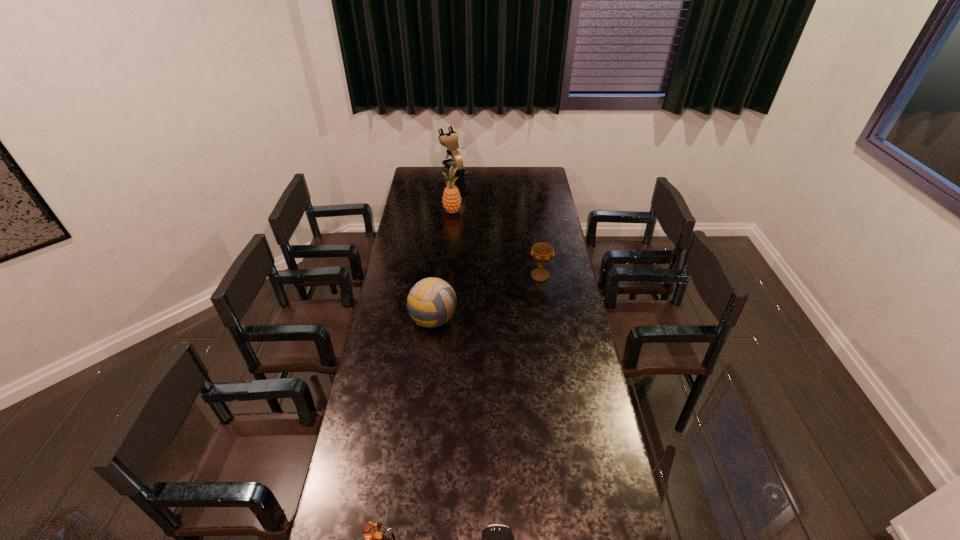
Identify the location of object that is at the far edge. The width and height of the screenshot is (960, 540). (449, 140).

Locate an element on the screen. object that is at the left edge is located at coordinates (431, 302).

Where is `object present at the right edge`? object present at the right edge is located at coordinates (542, 252).

Where is `free space at the far edge`? free space at the far edge is located at coordinates (476, 173).

Identify the location of blank area at the left edge. (431, 188).

Image resolution: width=960 pixels, height=540 pixels. I want to click on vacant point at the right edge, so click(537, 199).

Image resolution: width=960 pixels, height=540 pixels. What are the coordinates of `free space at the far left corner of the desktop` in the screenshot? It's located at (438, 171).

In the image, there is a desktop. Identify the location of vacant area at the far right corner. 549,186.

At what (x,y) coordinates should I click in order to perform the action: click on free point between the farthest object and the volleyball. Please return your answer as a coordinate pair (x, y). This screenshot has width=960, height=540. Looking at the image, I should click on (444, 249).

At what (x,y) coordinates should I click in order to perform the action: click on object identified as the fourth closest to the third tallest object. Please return your answer as a coordinate pair (x, y). Looking at the image, I should click on (496, 539).